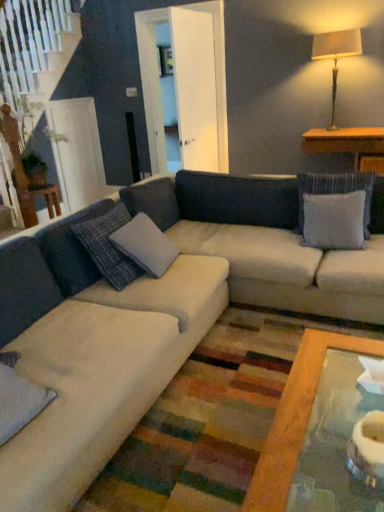
What do you see at coordinates (347, 140) in the screenshot? The width and height of the screenshot is (384, 512). I see `wooden table at right` at bounding box center [347, 140].

What do you see at coordinates (19, 401) in the screenshot? The image size is (384, 512). I see `velvety gray pillow at lower left, the 3th pillow from the right` at bounding box center [19, 401].

This screenshot has height=512, width=384. Describe the element at coordinates (336, 54) in the screenshot. I see `matte beige lampshade at upper right` at that location.

This screenshot has width=384, height=512. In order to click on wooden table at right in this screenshot , I will do `click(347, 140)`.

Locate an element on the screen. This screenshot has width=384, height=512. studio couch that appears above the velvety gray pillow at lower left, the third pillow positioned from the back (from the image's perspective) is located at coordinates (200, 271).

From the image's perspective, is velvety gray pillow at lower left, which appears as the 1th pillow when viewed from the front, below beige fabric couch at center?

Yes.

Is velvety gray pillow at lower left, which appears as the 1th pillow when viewed from the front, turned away from beige fabric couch at center?

Yes, velvety gray pillow at lower left, which appears as the 1th pillow when viewed from the front, is facing away from beige fabric couch at center.

Can you confirm if velvety gray pillow at lower left, the 3th pillow from the right, is smaller than beige fabric couch at center?

Yes, velvety gray pillow at lower left, the 3th pillow from the right, is smaller than beige fabric couch at center.

This screenshot has width=384, height=512. I want to click on table lamp to the right of velvety gray pillow at lower left, the third pillow positioned from the back, so click(336, 54).

Does velvety gray pillow at lower left, the 3th pillow from the right, appear on the right side of matte beige lampshade at upper right?

In fact, velvety gray pillow at lower left, the 3th pillow from the right, is to the left of matte beige lampshade at upper right.

From the picture: From a real-world perspective, is velvety gray pillow at lower left, the third pillow positioned from the back, positioned under matte beige lampshade at upper right based on gravity?

Indeed, from a real-world perspective, velvety gray pillow at lower left, the third pillow positioned from the back, is positioned beneath matte beige lampshade at upper right.

Which of these two, velvety gray pillow at lower left, the third pillow positioned from the back, or matte beige lampshade at upper right, stands taller?

Standing taller between the two is matte beige lampshade at upper right.

Looking at their sizes, would you say wooden table at right is wider or thinner than gray fabric pillow at center, which ranks as the 2th pillow in front-to-back order?

In the image, wooden table at right appears to be wider than gray fabric pillow at center, which ranks as the 2th pillow in front-to-back order.

Would you say wooden table at right contains gray fabric pillow at center, marked as the 2th pillow in a left-to-right arrangement?

That's incorrect, gray fabric pillow at center, marked as the 2th pillow in a left-to-right arrangement, is not inside wooden table at right.

From a real-world perspective, is wooden table at right beneath gray fabric pillow at center, marked as the 2th pillow in a left-to-right arrangement?

Incorrect, from a real-world perspective, wooden table at right is higher than gray fabric pillow at center, marked as the 2th pillow in a left-to-right arrangement.

Can you tell me how much wooden table at right and gray fabric pillow at center, the second pillow in the back-to-front sequence, differ in facing direction?

91.3 degrees.

Is gray fabric pillow at center, marked as the 2th pillow in a left-to-right arrangement, spatially inside gray fabric pillow at upper right, which appears as the third pillow when viewed from the front, or outside of it?

gray fabric pillow at center, marked as the 2th pillow in a left-to-right arrangement, exists outside the volume of gray fabric pillow at upper right, which appears as the third pillow when viewed from the front.

Is the depth of gray fabric pillow at center, marked as the 2th pillow in a left-to-right arrangement, greater than that of gray fabric pillow at upper right, which ranks as the first pillow in right-to-left order?

No.

Find the location of a particular element. The width and height of the screenshot is (384, 512). the 1st pillow in front when counting from the gray fabric pillow at upper right, which is counted as the 1th pillow, starting from the back is located at coordinates (145, 245).

What's the angular difference between gray fabric pillow at center, the second pillow in the back-to-front sequence, and gray fabric pillow at upper right, which ranks as the first pillow in right-to-left order,'s facing directions?

83 degrees.

Considering the relative sizes of beige fabric couch at center and wooden table at right in the image provided, is beige fabric couch at center smaller than wooden table at right?

No, beige fabric couch at center is not smaller than wooden table at right.

Would you say beige fabric couch at center is inside or outside wooden table at right?

beige fabric couch at center is outside wooden table at right.

Is beige fabric couch at center to the right of wooden table at right from the viewer's perspective?

In fact, beige fabric couch at center is to the left of wooden table at right.

Can you confirm if velvety gray pillow at lower left, the third pillow positioned from the back, is smaller than gray fabric pillow at upper right, which appears as the third pillow when viewed from the front?

Yes.

Looking at this image, could you tell me if velvety gray pillow at lower left, the 3th pillow from the right, is turned towards gray fabric pillow at upper right, which is counted as the 1th pillow, starting from the back?

No, velvety gray pillow at lower left, the 3th pillow from the right, is not oriented towards gray fabric pillow at upper right, which is counted as the 1th pillow, starting from the back.

Is velvety gray pillow at lower left, which appears as the 1th pillow when viewed from the front, next to gray fabric pillow at upper right, which ranks as the first pillow in right-to-left order, and touching it?

velvety gray pillow at lower left, which appears as the 1th pillow when viewed from the front, and gray fabric pillow at upper right, which ranks as the first pillow in right-to-left order, are clearly separated.

From a real-world perspective, who is located lower, velvety gray pillow at lower left, the third pillow positioned from the back, or gray fabric pillow at upper right, which appears as the third pillow when viewed from the front?

In real-world perspective, velvety gray pillow at lower left, the third pillow positioned from the back, is lower.

Is gray fabric pillow at center, marked as the 2th pillow in a left-to-right arrangement, looking in the opposite direction of wooden table at right?

No, gray fabric pillow at center, marked as the 2th pillow in a left-to-right arrangement, is not facing away from wooden table at right.

In terms of size, does gray fabric pillow at center, the second pillow in the back-to-front sequence, appear bigger or smaller than wooden table at right?

Considering their sizes, gray fabric pillow at center, the second pillow in the back-to-front sequence, takes up less space than wooden table at right.

From the image's perspective, is gray fabric pillow at center, marked as the 2th pillow in a left-to-right arrangement, located above wooden table at right?

No, from the image's perspective, gray fabric pillow at center, marked as the 2th pillow in a left-to-right arrangement, is not on top of wooden table at right.

You are a GUI agent. You are given a task and a screenshot of the screen. Output one action in this format:
    pyautogui.click(x=<x>, y=<y>)
    Task: Click on the studio couch located in front of the velvety gray pillow at lower left, which appears as the 1th pillow when viewed from the front
    This screenshot has height=512, width=384.
    Given the screenshot: What is the action you would take?
    coord(200,271)

The width and height of the screenshot is (384, 512). Find the location of `the 3rd pillow positioned below the matte beige lampshade at upper right (from a real-world perspective)`. the 3rd pillow positioned below the matte beige lampshade at upper right (from a real-world perspective) is located at coordinates (19, 401).

Based on their spatial positions, is gray fabric pillow at center, which ranks as the 2th pillow in front-to-back order, or gray fabric pillow at upper right, the third pillow viewed from the left, further from beige fabric couch at center?

gray fabric pillow at upper right, the third pillow viewed from the left, is further to beige fabric couch at center.

When comparing their distances from beige fabric couch at center, does gray fabric pillow at upper right, which is counted as the 1th pillow, starting from the back, or matte beige lampshade at upper right seem closer?

gray fabric pillow at upper right, which is counted as the 1th pillow, starting from the back, lies closer to beige fabric couch at center than the other object.

When comparing their distances from gray fabric pillow at upper right, which appears as the third pillow when viewed from the front, does matte beige lampshade at upper right or velvety gray pillow at lower left, the third pillow positioned from the back, seem further?

Among the two, matte beige lampshade at upper right is located further to gray fabric pillow at upper right, which appears as the third pillow when viewed from the front.

Considering their positions, is gray fabric pillow at center, the second pillow in the back-to-front sequence, positioned closer to matte beige lampshade at upper right than wooden table at right?

wooden table at right lies closer to matte beige lampshade at upper right than the other object.

Considering their positions, is matte beige lampshade at upper right positioned further to beige fabric couch at center than gray fabric pillow at upper right, the third pillow viewed from the left?

Among the two, matte beige lampshade at upper right is located further to beige fabric couch at center.

Consider the image. Considering their positions, is matte beige lampshade at upper right positioned closer to gray fabric pillow at center, placed as the 2th pillow when sorted from right to left, than wooden table at right?

wooden table at right lies closer to gray fabric pillow at center, placed as the 2th pillow when sorted from right to left, than the other object.

Which object lies further to the anchor point gray fabric pillow at upper right, the third pillow viewed from the left, gray fabric pillow at center, which ranks as the 2th pillow in front-to-back order, or wooden table at right?

wooden table at right lies further to gray fabric pillow at upper right, the third pillow viewed from the left, than the other object.

From the image, which object appears to be nearer to beige fabric couch at center, velvety gray pillow at lower left, which is counted as the first pillow, starting from the left, or wooden table at right?

velvety gray pillow at lower left, which is counted as the first pillow, starting from the left, lies closer to beige fabric couch at center than the other object.

This screenshot has width=384, height=512. In order to click on pillow between velvety gray pillow at lower left, which is counted as the first pillow, starting from the left, and gray fabric pillow at upper right, which ranks as the first pillow in right-to-left order, in the horizontal direction in this screenshot , I will do `click(145, 245)`.

The image size is (384, 512). I want to click on table lamp located between velvety gray pillow at lower left, which is counted as the first pillow, starting from the left, and wooden table at right in the depth direction, so click(x=336, y=54).

You are a GUI agent. You are given a task and a screenshot of the screen. Output one action in this format:
    pyautogui.click(x=<x>, y=<y>)
    Task: Click on the table between matte beige lampshade at upper right and gray fabric pillow at upper right, which ranks as the first pillow in right-to-left order, vertically
    
    Given the screenshot: What is the action you would take?
    pyautogui.click(x=347, y=140)

You are a GUI agent. You are given a task and a screenshot of the screen. Output one action in this format:
    pyautogui.click(x=<x>, y=<y>)
    Task: Click on the table lamp between beige fabric couch at center and wooden table at right along the z-axis
    This screenshot has width=384, height=512.
    Given the screenshot: What is the action you would take?
    pyautogui.click(x=336, y=54)